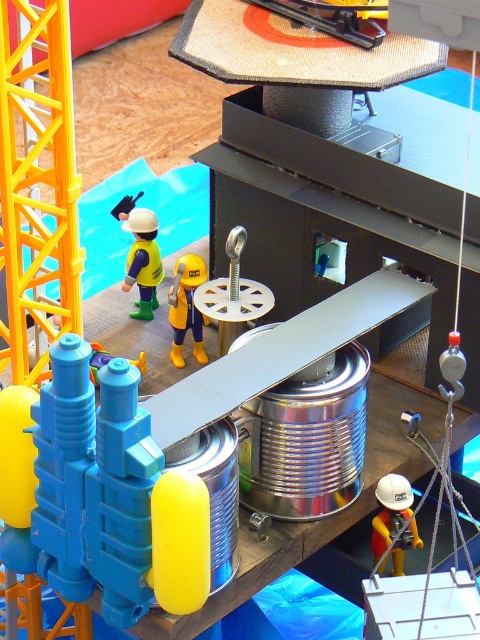
Who is taller, matte blue cylinder at center or yellow matte construction worker at center?

Standing taller between the two is matte blue cylinder at center.

Does point (112, 568) lie behind point (130, 214)?

No, it is in front of (130, 214).

Image resolution: width=480 pixels, height=640 pixels. What do you see at coordinates (103, 496) in the screenshot?
I see `matte blue cylinder at center` at bounding box center [103, 496].

The height and width of the screenshot is (640, 480). I want to click on matte blue cylinder at center, so click(x=103, y=496).

Who is higher up, white matte hard hat at lower right or yellow rubber boots at center?

yellow rubber boots at center

Image resolution: width=480 pixels, height=640 pixels. In order to click on white matte hard hat at lower right in this screenshot , I will do `click(389, 512)`.

Is matte blue cylinder at center bigger than white matte hard hat at lower right?

Yes, matte blue cylinder at center is bigger than white matte hard hat at lower right.

Between matte blue cylinder at center and white matte hard hat at lower right, which one has less height?

Standing shorter between the two is white matte hard hat at lower right.

Find the location of `matte blue cylinder at center`. matte blue cylinder at center is located at coordinates (103, 496).

You are a GUI agent. You are given a task and a screenshot of the screen. Output one action in this format:
    pyautogui.click(x=<x>, y=<y>)
    Task: Click on the matte blue cylinder at center
    The width and height of the screenshot is (480, 640).
    Given the screenshot: What is the action you would take?
    pyautogui.click(x=103, y=496)